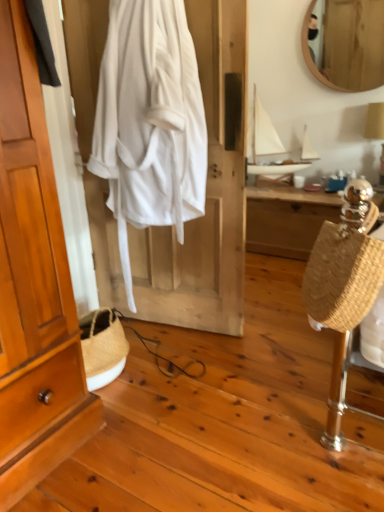
At what (x,y) coordinates should I click in order to perform the action: click on free space above wooden desk at center (from a real-world perspective). Please return your answer as a coordinate pair (x, y). This screenshot has height=512, width=384. Looking at the image, I should click on (292, 190).